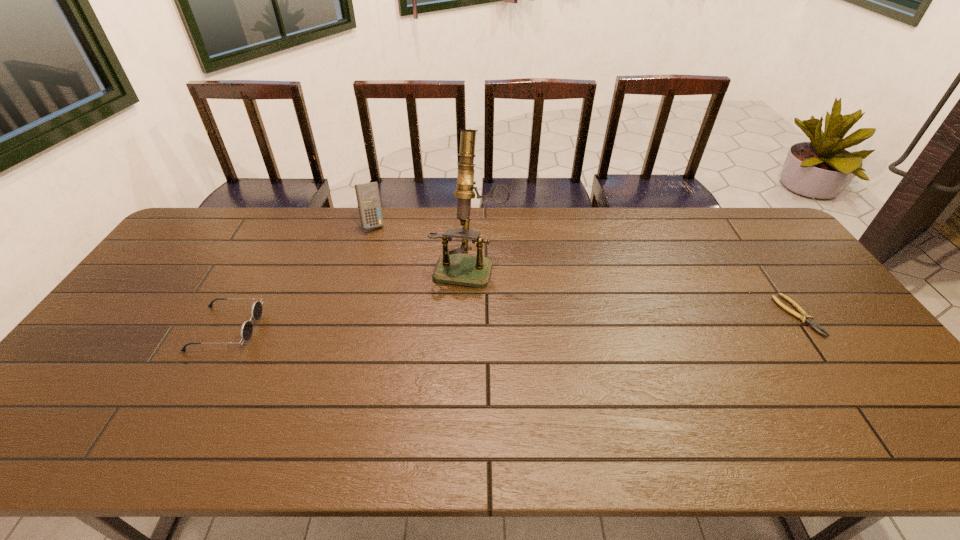
You are a GUI agent. You are given a task and a screenshot of the screen. Output one action in this format:
    pyautogui.click(x=<x>, y=<y>)
    Task: Click on the free space on the desktop that is between the leftmost object and the rightmost object and is positioned at the eyepiece of the tallest object
    
    Given the screenshot: What is the action you would take?
    pyautogui.click(x=452, y=323)

Identify the location of free space on the desktop that is between the leftmost object and the shortest object and is positioned on the front-facing side of the third object from right to left. The height and width of the screenshot is (540, 960). (432, 323).